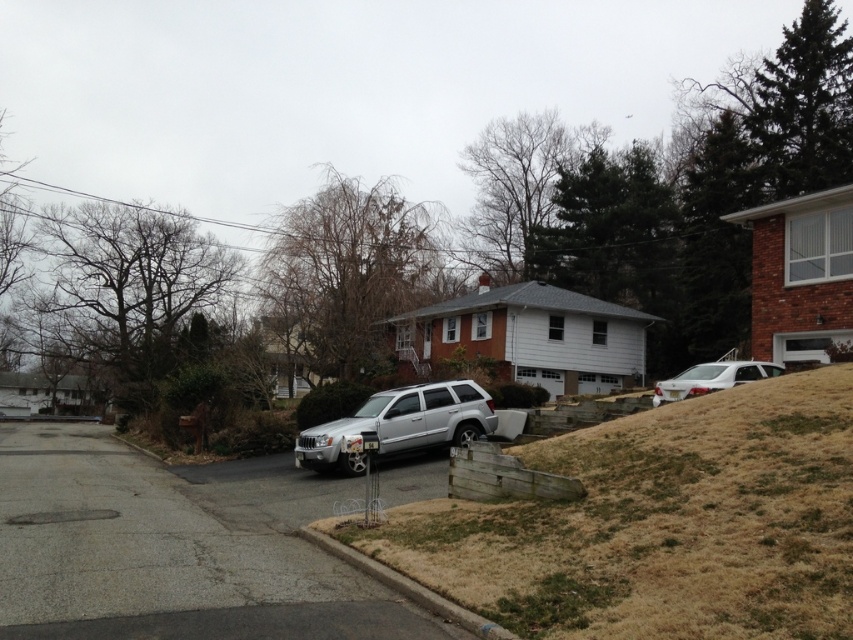
Question: Which of these objects is positioned farthest from the white glossy sedan at upper right?

Choices:
 (A) brown grass at lower right
 (B) silver metallic suv at center
 (C) brown concrete curb at lower center

Answer: (A)

Question: Is brown grass at lower right to the right of white glossy sedan at upper right from the viewer's perspective?

Choices:
 (A) yes
 (B) no

Answer: (B)

Question: Can you confirm if silver metallic suv at center is wider than white glossy sedan at upper right?

Choices:
 (A) no
 (B) yes

Answer: (A)

Question: Observing the image, what is the correct spatial positioning of brown concrete curb at lower center in reference to white glossy sedan at upper right?

Choices:
 (A) left
 (B) right

Answer: (A)

Question: Which point is closer to the camera?

Choices:
 (A) (462, 397)
 (B) (456, 609)
 (C) (474, 609)

Answer: (C)

Question: Which object appears closest to the camera in this image?

Choices:
 (A) silver metallic suv at center
 (B) white glossy sedan at upper right
 (C) brown grass at lower right

Answer: (C)